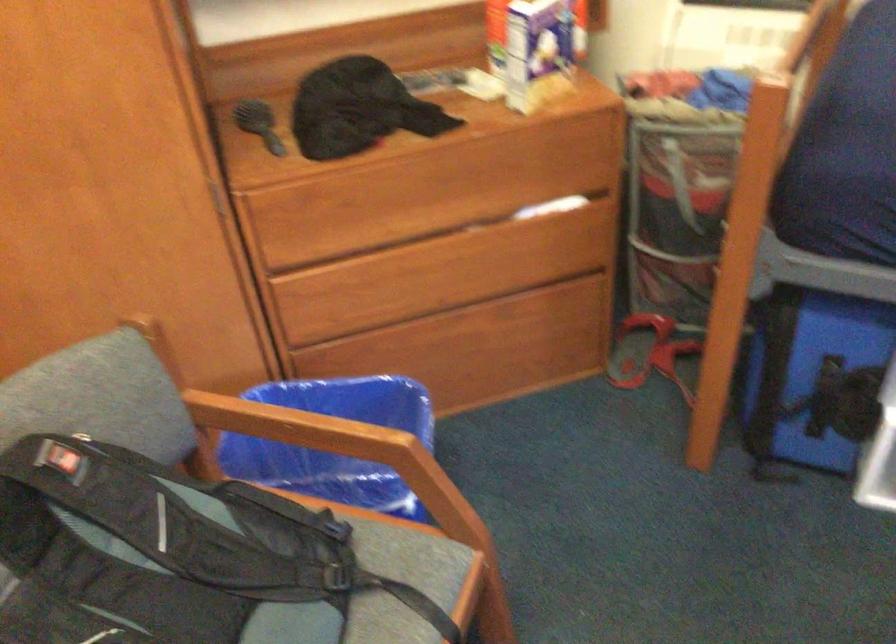
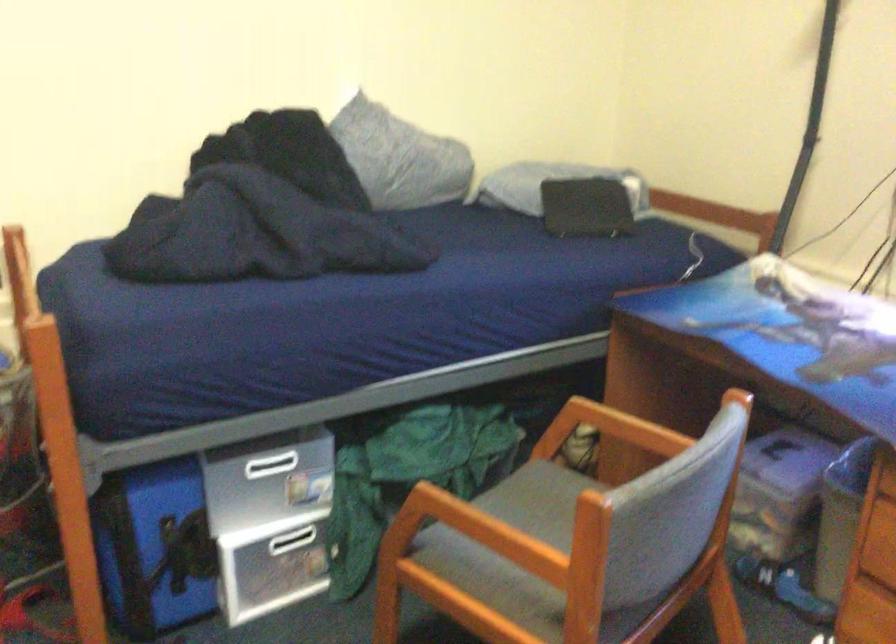
Question: Based on the continuous images, in which direction is the camera rotating? Reply with the corresponding letter.

Choices:
 (A) Left
 (B) Right
 (C) Up
 (D) Down

Answer: (B)